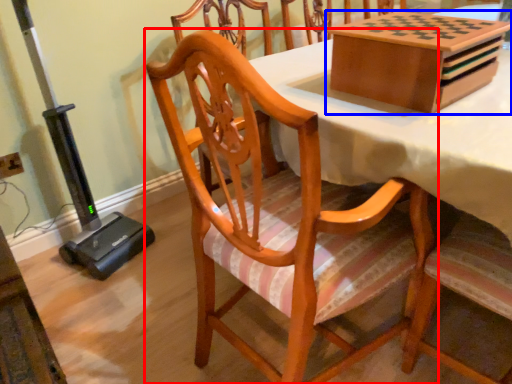
Question: Which point is further to the camera, chair (highlighted by a red box) or cardboard box (highlighted by a blue box)?

Choices:
 (A) chair
 (B) cardboard box

Answer: (B)